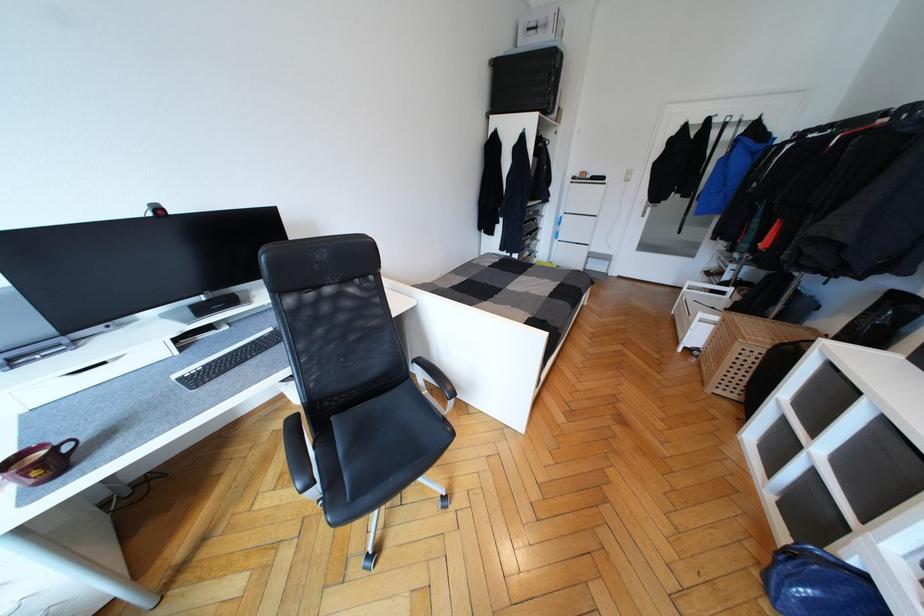
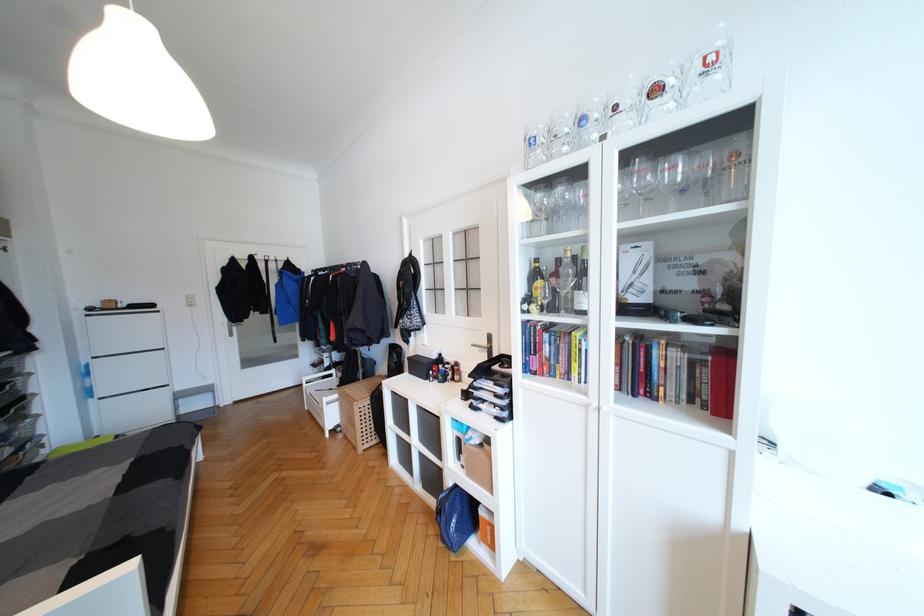
Find the pixel in the second image that matches (714,329) in the first image.

(339, 405)